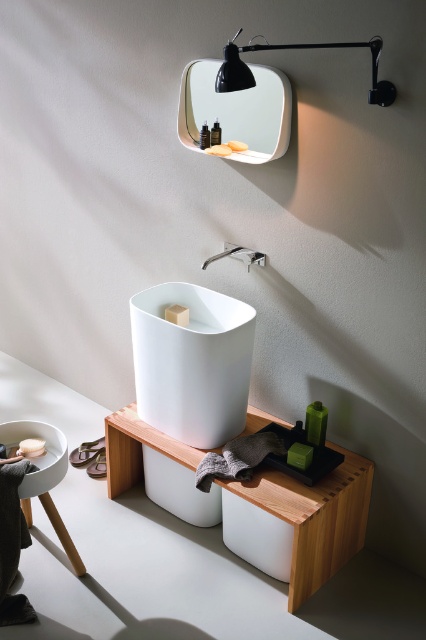
You are standing in the bathroom and see both the matte white soap at upper center and the orange matte soap at upper center on the mirror. Which soap is closer to you?

The matte white soap at upper center is closer to you because it is further to the viewer than the orange matte soap at upper center.

From the picture: You are designing a bathroom layout and need to place a 12 cm tall decorative vase on an object that can support its weight. Which object between the white matte stool at lower left and the matte white soap at upper center would be suitable for placing the vase?

The white matte stool at lower left has a greater height compared to the matte white soap at upper center, making it suitable to place the 12 cm tall decorative vase as it can support the height and weight better.